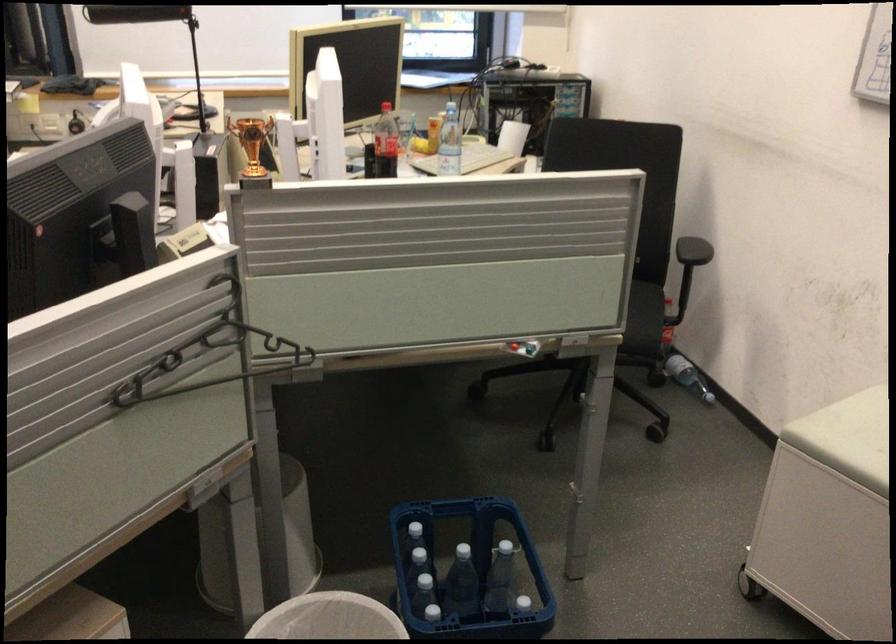
Where would you resting arm the black chair armrest? Please return your answer as a coordinate pair (x, y).

(693, 251)